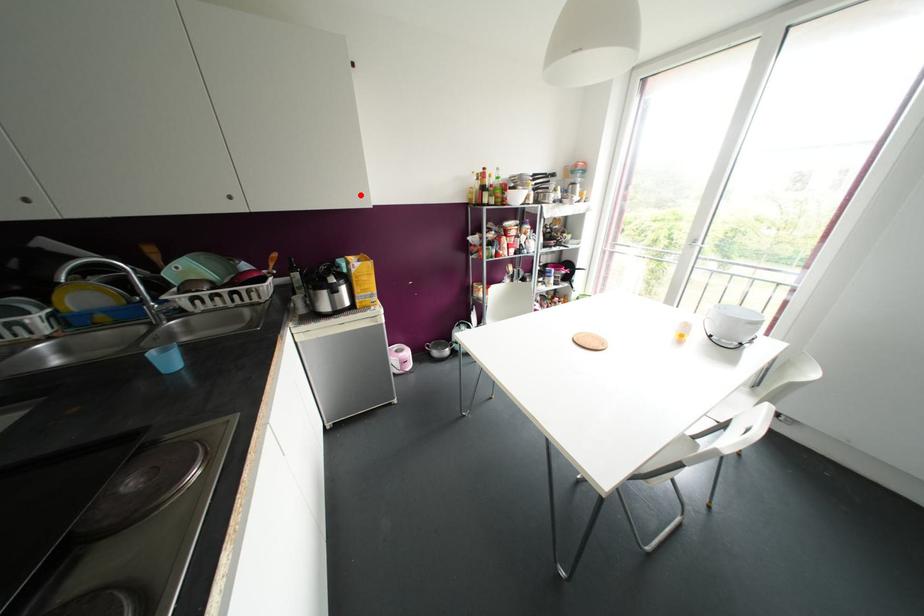
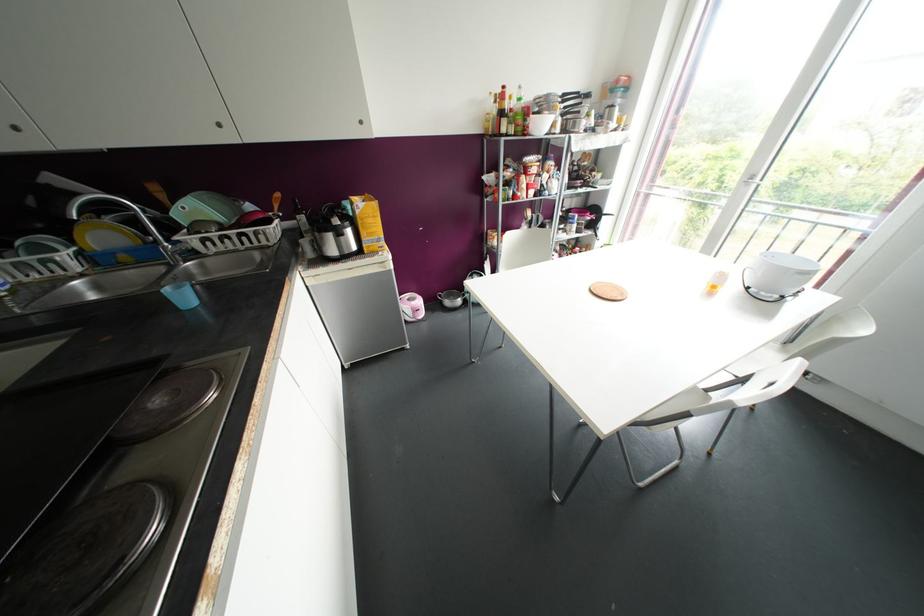
Where in the second image is the point corresponding to the highlighted location from the first image?

(360, 122)